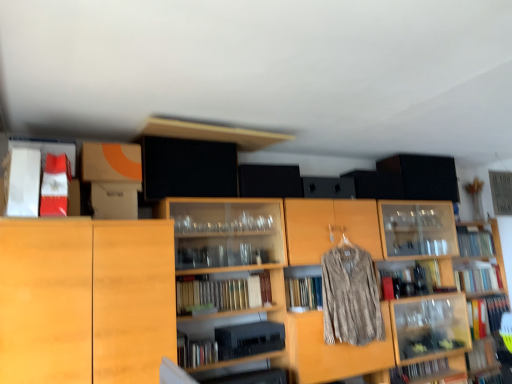
Question: Does point (66, 162) appear closer or farther from the camera than point (262, 284)?

Choices:
 (A) closer
 (B) farther

Answer: (A)

Question: In the image, is matte red book at upper left, which ranks as the sixth book in bottom-to-top order, on the left side or the right side of hardcover books at center, marked as the fifth book in a back-to-front arrangement?

Choices:
 (A) left
 (B) right

Answer: (A)

Question: Which is farther from the matte red book at upper left, arranged as the sixth book when viewed from the back?

Choices:
 (A) wooden bookshelf at center, the first shelf from the left
 (B) hardcover books at center, marked as the 4th book in a bottom-to-top arrangement
 (C) hardcover book at right, the fifth book viewed from the front
 (D) light wood cabinet at left
 (E) textured beige shirt at center

Answer: (C)

Question: Which object is positioned closest to the clear glass shelves at upper right, the second shelf from the left?

Choices:
 (A) matte red book at upper left, the first book when ordered from front to back
 (B) hardcover book at lower right, which ranks as the third book in back-to-front order
 (C) hardcover book at lower right, which is the third book in left-to-right order
 (D) hardcover book at upper right, the 5th book viewed from the left
 (E) hardcover books at center, marked as the 4th book in a bottom-to-top arrangement

Answer: (B)